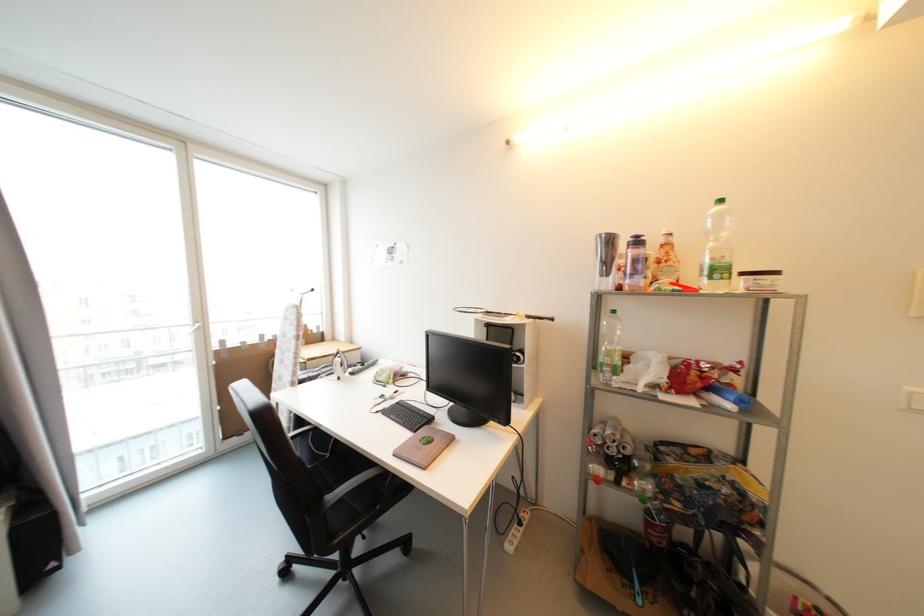
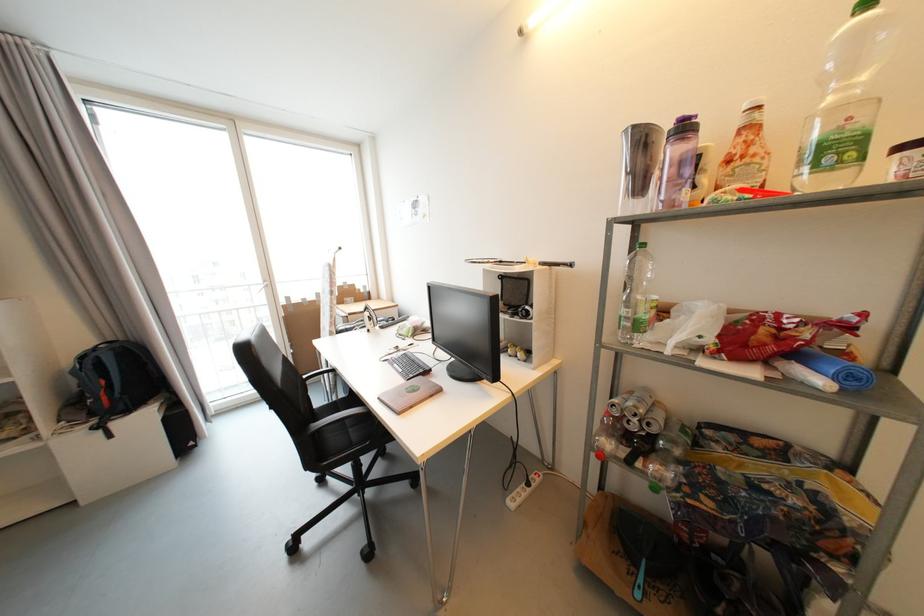
The point at [493,314] is marked in the first image. Where is the corresponding point in the second image?

(505, 264)